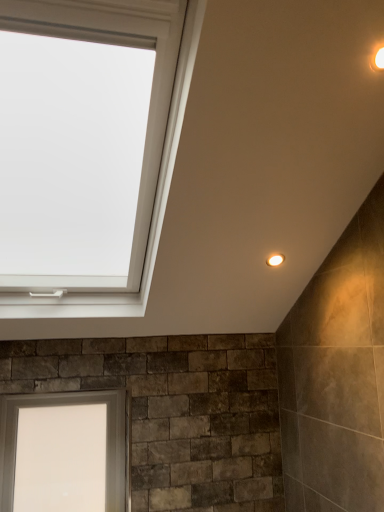
Locate an element on the screen. The height and width of the screenshot is (512, 384). matte white light fixture at upper right, the 1th light fixture when ordered from back to front is located at coordinates (275, 260).

The height and width of the screenshot is (512, 384). What do you see at coordinates (378, 59) in the screenshot? I see `warm matte light fixture at upper right, the second light fixture from the left` at bounding box center [378, 59].

From the picture: What is the approximate height of warm matte light fixture at upper right, which is the 1th light fixture in front-to-back order?

1.96 inches.

Identify the location of white glass window at lower left. (65, 404).

Describe the element at coordinates (65, 404) in the screenshot. Image resolution: width=384 pixels, height=512 pixels. I see `white glass window at lower left` at that location.

Locate an element on the screen. The height and width of the screenshot is (512, 384). matte white light fixture at upper right, acting as the 2th light fixture starting from the right is located at coordinates (275, 260).

Is white glass window at lower left completely or partially outside of warm matte light fixture at upper right, which is counted as the first light fixture, starting from the top?

Absolutely, white glass window at lower left is external to warm matte light fixture at upper right, which is counted as the first light fixture, starting from the top.

Is white glass window at lower left next to warm matte light fixture at upper right, which is the 1th light fixture in front-to-back order, and touching it?

No, white glass window at lower left is not next to warm matte light fixture at upper right, which is the 1th light fixture in front-to-back order.

From a real-world perspective, between white glass window at lower left and warm matte light fixture at upper right, the second light fixture in the bottom-to-top sequence, who is vertically higher?

warm matte light fixture at upper right, the second light fixture in the bottom-to-top sequence, is physically above.

Is white glass window at lower left facing towards warm matte light fixture at upper right, which is the first light fixture in right-to-left order?

No, white glass window at lower left is not oriented towards warm matte light fixture at upper right, which is the first light fixture in right-to-left order.

Considering the sizes of objects white glass window at lower left and matte white light fixture at upper right, acting as the 2th light fixture starting from the right, in the image provided, who is taller, white glass window at lower left or matte white light fixture at upper right, acting as the 2th light fixture starting from the right,?

With more height is white glass window at lower left.

Is white glass window at lower left directly adjacent to matte white light fixture at upper right, which is counted as the 2th light fixture, starting from the front?

No, white glass window at lower left is not next to matte white light fixture at upper right, which is counted as the 2th light fixture, starting from the front.

Looking at this image, which is farther, (2, 396) or (277, 264)?

The point (2, 396) is farther.

Considering the positions of objects white glass window at lower left and matte white light fixture at upper right, which is counted as the 2th light fixture, starting from the front, in the image provided, who is more to the left, white glass window at lower left or matte white light fixture at upper right, which is counted as the 2th light fixture, starting from the front,?

Positioned to the left is white glass window at lower left.

From the image's perspective, is matte white light fixture at upper right, which is counted as the 1th light fixture, starting from the bottom, located above warm matte light fixture at upper right, which is counted as the first light fixture, starting from the top?

No.

Is point (270, 266) more distant than point (382, 68)?

Yes, it is behind point (382, 68).

Which object is thinner, matte white light fixture at upper right, the first light fixture viewed from the left, or warm matte light fixture at upper right, which is the 1th light fixture in front-to-back order?

warm matte light fixture at upper right, which is the 1th light fixture in front-to-back order, is thinner.

From a real-world perspective, is matte white light fixture at upper right, which is counted as the 1th light fixture, starting from the bottom, positioned above or below warm matte light fixture at upper right, the second light fixture in the bottom-to-top sequence?

In terms of real-world spatial position, matte white light fixture at upper right, which is counted as the 1th light fixture, starting from the bottom, is below warm matte light fixture at upper right, the second light fixture in the bottom-to-top sequence.

From a real-world perspective, does matte white light fixture at upper right, the first light fixture viewed from the left, sit lower than white glass window at lower left?

Actually, matte white light fixture at upper right, the first light fixture viewed from the left, is physically above white glass window at lower left in the real world.

Which is behind, matte white light fixture at upper right, which is counted as the 1th light fixture, starting from the bottom, or white glass window at lower left?

Positioned behind is white glass window at lower left.

Is matte white light fixture at upper right, the first light fixture viewed from the left, inside the boundaries of white glass window at lower left, or outside?

matte white light fixture at upper right, the first light fixture viewed from the left, is located beyond the bounds of white glass window at lower left.

From the white glass window at lower left, count 2nd light fixtures forward and point to it. Please provide its 2D coordinates.

[(378, 59)]

Consider the image. Considering the relative sizes of warm matte light fixture at upper right, the second light fixture in the bottom-to-top sequence, and white glass window at lower left in the image provided, is warm matte light fixture at upper right, the second light fixture in the bottom-to-top sequence, wider than white glass window at lower left?

No.

Between warm matte light fixture at upper right, the second light fixture in the bottom-to-top sequence, and white glass window at lower left, which one is positioned behind?

white glass window at lower left is more distant.

From a real-world perspective, between warm matte light fixture at upper right, the second light fixture from the left, and white glass window at lower left, who is vertically higher?

warm matte light fixture at upper right, the second light fixture from the left, from a real-world perspective.

Considering their positions, is warm matte light fixture at upper right, which is the first light fixture in right-to-left order, located in front of or behind matte white light fixture at upper right, acting as the 2th light fixture starting from the right?

Visually, warm matte light fixture at upper right, which is the first light fixture in right-to-left order, is located in front of matte white light fixture at upper right, acting as the 2th light fixture starting from the right.

Which is correct: warm matte light fixture at upper right, which is the first light fixture in right-to-left order, is inside matte white light fixture at upper right, the first light fixture viewed from the left, or outside of it?

warm matte light fixture at upper right, which is the first light fixture in right-to-left order, exists outside the volume of matte white light fixture at upper right, the first light fixture viewed from the left.

Does warm matte light fixture at upper right, which is counted as the first light fixture, starting from the top, have a greater width compared to matte white light fixture at upper right, acting as the 2th light fixture starting from the right?

In fact, warm matte light fixture at upper right, which is counted as the first light fixture, starting from the top, might be narrower than matte white light fixture at upper right, acting as the 2th light fixture starting from the right.

Looking at this image, from a real-world perspective, is warm matte light fixture at upper right, which is the first light fixture in right-to-left order, on top of matte white light fixture at upper right, the 2th light fixture from the top?

Indeed, from a real-world perspective, warm matte light fixture at upper right, which is the first light fixture in right-to-left order, stands above matte white light fixture at upper right, the 2th light fixture from the top.

Find the location of a particular element. The image size is (384, 512). window below the warm matte light fixture at upper right, which is the 1th light fixture in front-to-back order (from a real-world perspective) is located at coordinates (65, 404).

From the image's perspective, starting from the white glass window at lower left, which light fixture is the 1st one above? Please provide its 2D coordinates.

[(275, 260)]

Consider the image. Considering their positions, is warm matte light fixture at upper right, the second light fixture when ordered from back to front, positioned further to white glass window at lower left than matte white light fixture at upper right, which is counted as the 2th light fixture, starting from the front?

Based on the image, warm matte light fixture at upper right, the second light fixture when ordered from back to front, appears to be further to white glass window at lower left.

From the image, which object appears to be farther from matte white light fixture at upper right, the 1th light fixture when ordered from back to front, white glass window at lower left or warm matte light fixture at upper right, the second light fixture from the left?

white glass window at lower left is further to matte white light fixture at upper right, the 1th light fixture when ordered from back to front.

From the image, which object appears to be nearer to matte white light fixture at upper right, acting as the 2th light fixture starting from the right, warm matte light fixture at upper right, the second light fixture when ordered from back to front, or white glass window at lower left?

Among the two, warm matte light fixture at upper right, the second light fixture when ordered from back to front, is located nearer to matte white light fixture at upper right, acting as the 2th light fixture starting from the right.

Based on their spatial positions, is matte white light fixture at upper right, the 1th light fixture when ordered from back to front, or white glass window at lower left closer to warm matte light fixture at upper right, the second light fixture in the bottom-to-top sequence?

matte white light fixture at upper right, the 1th light fixture when ordered from back to front, is closer to warm matte light fixture at upper right, the second light fixture in the bottom-to-top sequence.

From the image, which object appears to be nearer to warm matte light fixture at upper right, the second light fixture when ordered from back to front, white glass window at lower left or matte white light fixture at upper right, the 2th light fixture from the top?

The object closer to warm matte light fixture at upper right, the second light fixture when ordered from back to front, is matte white light fixture at upper right, the 2th light fixture from the top.

Estimate the real-world distances between objects in this image. Which object is closer to white glass window at lower left, matte white light fixture at upper right, the first light fixture viewed from the left, or warm matte light fixture at upper right, which is the 1th light fixture in front-to-back order?

The object closer to white glass window at lower left is matte white light fixture at upper right, the first light fixture viewed from the left.

Where is `light fixture between warm matte light fixture at upper right, the second light fixture when ordered from back to front, and white glass window at lower left in the up-down direction`? The image size is (384, 512). light fixture between warm matte light fixture at upper right, the second light fixture when ordered from back to front, and white glass window at lower left in the up-down direction is located at coordinates (275, 260).